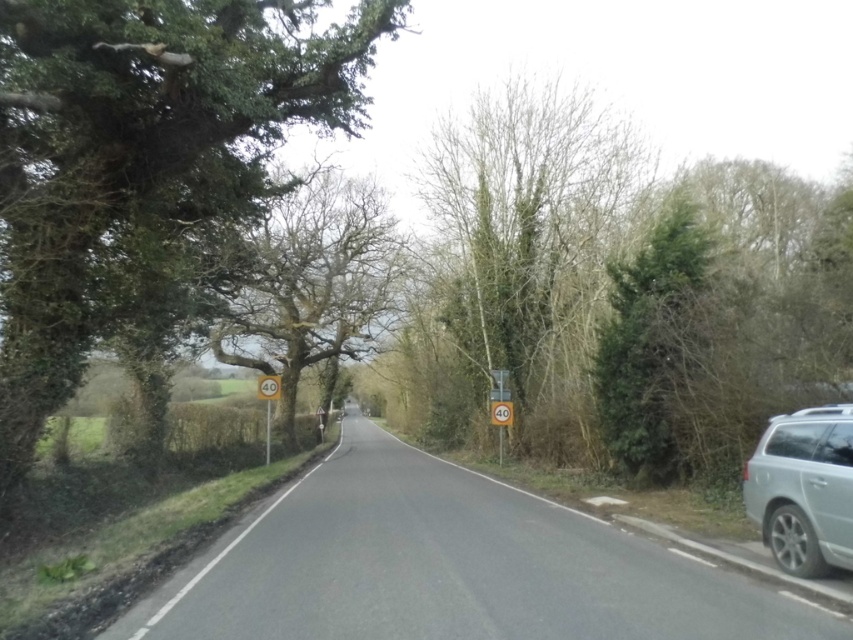
Consider the image. Is silver metallic car at right in front of green leafy tree at center?

Yes, it is in front of green leafy tree at center.

In order to click on silver metallic car at right in this screenshot , I will do `click(451, 566)`.

The height and width of the screenshot is (640, 853). What are the coordinates of `silver metallic car at right` in the screenshot? It's located at pyautogui.click(x=451, y=566).

Can you confirm if silver metallic car at right is positioned to the left of bare branches at center?

Indeed, silver metallic car at right is positioned on the left side of bare branches at center.

In the scene shown: Is silver metallic car at right above bare branches at center?

Incorrect, silver metallic car at right is not positioned above bare branches at center.

Where is `silver metallic car at right`? This screenshot has height=640, width=853. silver metallic car at right is located at coordinates (451, 566).

Locate an element on the screen. Image resolution: width=853 pixels, height=640 pixels. silver metallic car at right is located at coordinates (451, 566).

Is green leafy tree at center taller than yellow plastic speed limit sign at left?

Indeed, green leafy tree at center has a greater height compared to yellow plastic speed limit sign at left.

The width and height of the screenshot is (853, 640). Describe the element at coordinates (311, 284) in the screenshot. I see `green leafy tree at center` at that location.

Image resolution: width=853 pixels, height=640 pixels. I want to click on green leafy tree at center, so click(x=311, y=284).